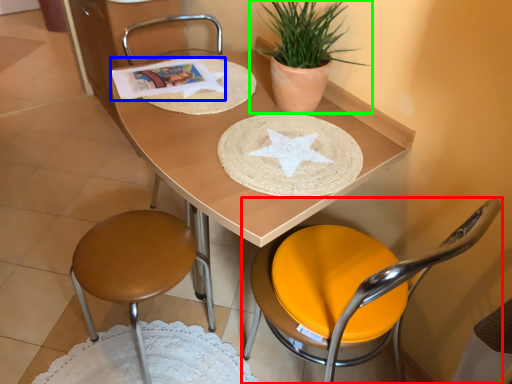
Question: Estimate the real-world distances between objects in this image. Which object is closer to chair (highlighted by a red box), magazine (highlighted by a blue box) or houseplant (highlighted by a green box)?

Choices:
 (A) magazine
 (B) houseplant

Answer: (B)